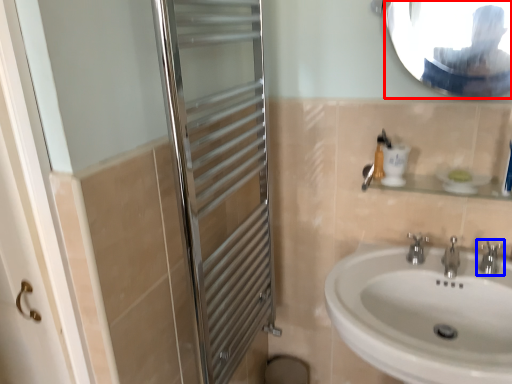
Question: Which point is further to the camera, mirror (highlighted by a red box) or tap (highlighted by a blue box)?

Choices:
 (A) mirror
 (B) tap

Answer: (B)